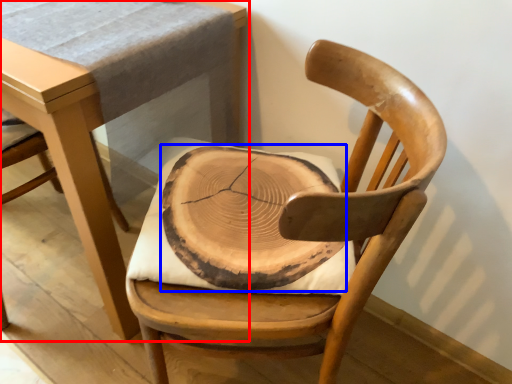
Question: Which object appears farthest to the camera in this image, table (highlighted by a red box) or pad (highlighted by a blue box)?

Choices:
 (A) table
 (B) pad

Answer: (B)